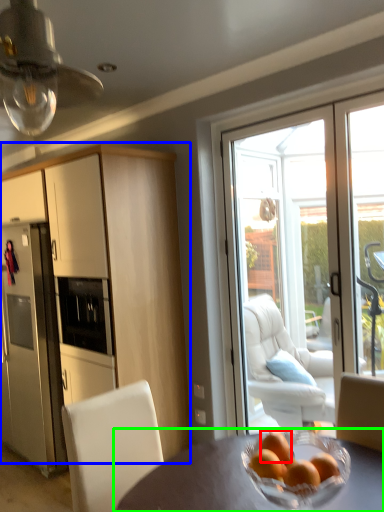
Question: Which is farther away from orange (highlighted by a red box)? cabinetry (highlighted by a blue box) or table (highlighted by a green box)?

Choices:
 (A) cabinetry
 (B) table

Answer: (A)